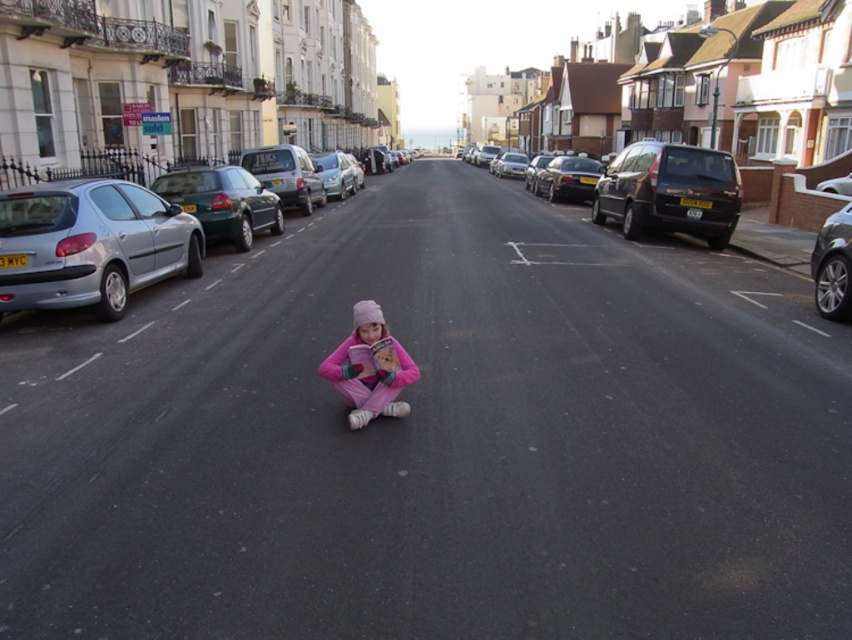
You are a delivery driver who needs to park your vehicle in a spot that can accommodate your truck, which is 1.8 meters in height. You see the silver metallic hatchback at left and the shiny black car at center. Which parking spot between these two vehicles would be suitable for your truck?

The shiny black car at center is taller than the silver metallic hatchback at left. Since your truck requires a height of 1.8 meters, the parking spot near the shiny black car at center would be more suitable as it can accommodate taller vehicles.

You are a delivery driver who needs to turn left onto a side street ahead. Your vehicle is the silver metallic sedan at center. There is a black matte van at right blocking your path. Can you safely make the turn without moving the van?

The black matte van at right is in front of the silver metallic sedan at center, so the van is blocking the path. You cannot safely make the left turn without moving the van.